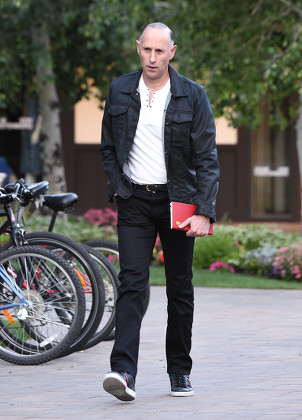
Identify the location of book. The width and height of the screenshot is (302, 420). (181, 213).